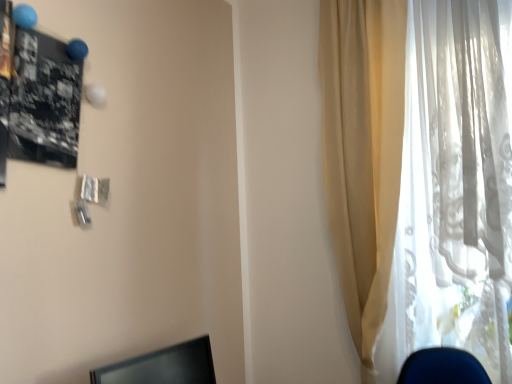
Question: From the image's perspective, is black glossy monitor at lower left located above or below translucent white curtain at right?

Choices:
 (A) above
 (B) below

Answer: (B)

Question: Relative to translucent white curtain at right, is black glossy monitor at lower left in front or behind?

Choices:
 (A) behind
 (B) front

Answer: (B)

Question: Do you think black glossy monitor at lower left is within translucent white curtain at right, or outside of it?

Choices:
 (A) outside
 (B) inside

Answer: (A)

Question: Is translucent white curtain at right in front of or behind black glossy monitor at lower left in the image?

Choices:
 (A) front
 (B) behind

Answer: (B)

Question: From the image's perspective, is translucent white curtain at right located above or below black glossy monitor at lower left?

Choices:
 (A) below
 (B) above

Answer: (B)

Question: Is translucent white curtain at right spatially inside black glossy monitor at lower left, or outside of it?

Choices:
 (A) outside
 (B) inside

Answer: (A)

Question: From a real-world perspective, is translucent white curtain at right physically located above or below black glossy monitor at lower left?

Choices:
 (A) below
 (B) above

Answer: (B)